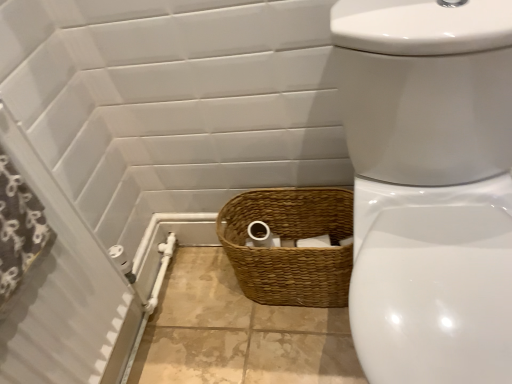
Question: Considering the positions of white glossy toilet at center and brown woven basket at lower center in the image, is white glossy toilet at center bigger or smaller than brown woven basket at lower center?

Choices:
 (A) small
 (B) big

Answer: (B)

Question: Considering the positions of point (486, 153) and point (303, 210), is point (486, 153) closer or farther from the camera than point (303, 210)?

Choices:
 (A) closer
 (B) farther

Answer: (A)

Question: Estimate the real-world distances between objects in this image. Which object is closer to the white glossy toilet at center?

Choices:
 (A) brown woven basket at lower center
 (B) white textured screen door at left
 (C) black fabric shower curtain at left

Answer: (A)

Question: Estimate the real-world distances between objects in this image. Which object is closer to the white textured screen door at left?

Choices:
 (A) brown woven basket at lower center
 (B) white glossy toilet at center
 (C) black fabric shower curtain at left

Answer: (C)